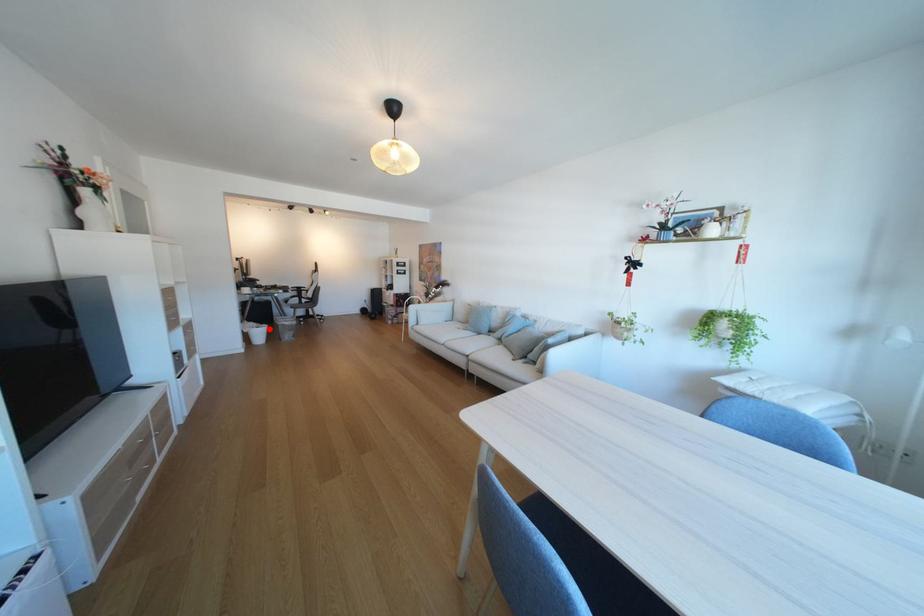
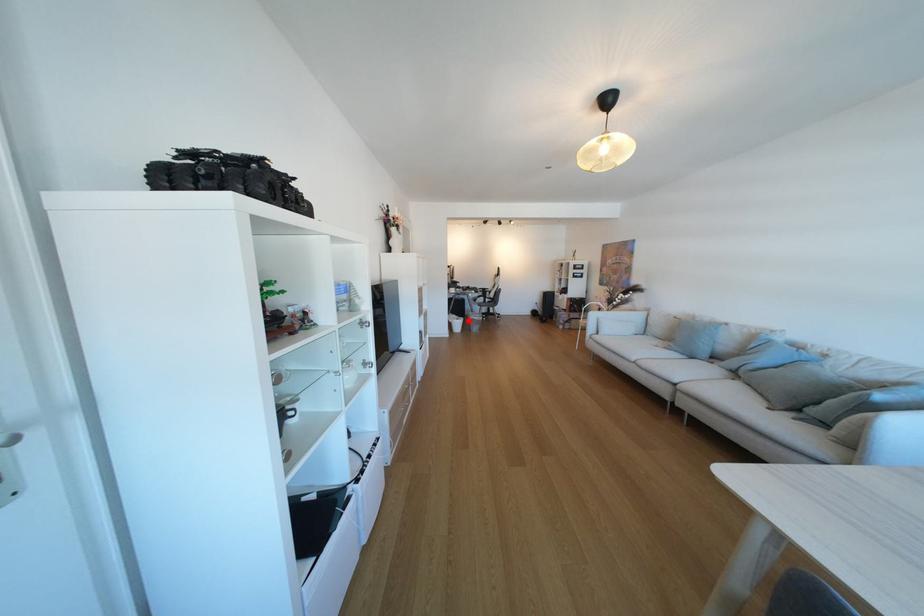
I am providing you with two images of the same scene from different viewpoints. A red point is marked on the first image and another point is marked on the second image. Is the marked point in image1 the same physical position as the marked point in image2?

Yes